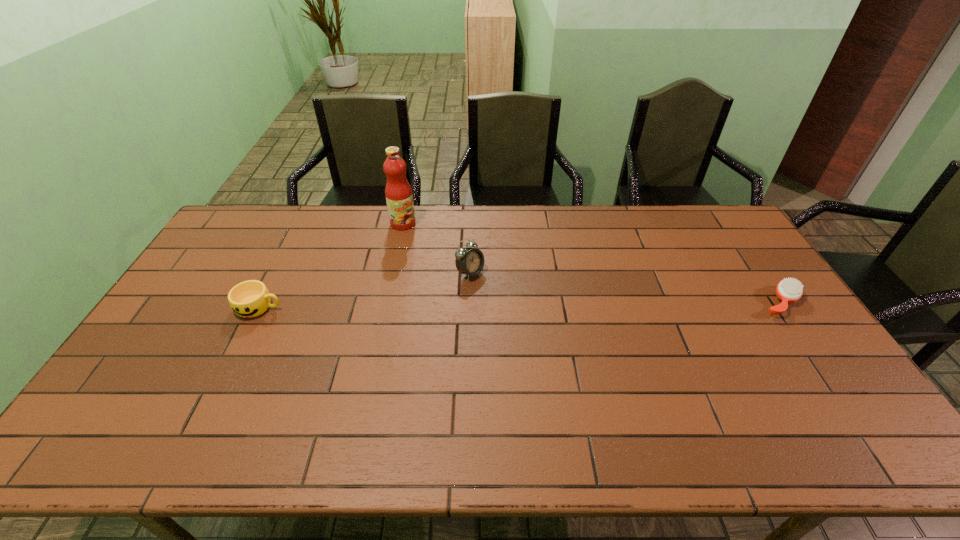
The image size is (960, 540). What are the coordinates of `free space at the right edge of the desktop` in the screenshot? It's located at (736, 261).

In the image, there is a desktop. In order to click on vacant space at the far left corner in this screenshot , I will do pyautogui.click(x=261, y=231).

What are the coordinates of `free space between the second object from right to left and the rightmost object` in the screenshot? It's located at (625, 287).

This screenshot has height=540, width=960. What are the coordinates of `vacant space that's between the fruit juice and the third nearest object` in the screenshot? It's located at (437, 248).

The image size is (960, 540). Identify the location of unoccupied area between the second tallest object and the cup. (365, 290).

The height and width of the screenshot is (540, 960). Find the location of `vacant point located between the second object from left to right and the second shortest object`. vacant point located between the second object from left to right and the second shortest object is located at coordinates (331, 265).

In order to click on vacant area between the second farthest object and the cup in this screenshot , I will do `click(365, 290)`.

You are a GUI agent. You are given a task and a screenshot of the screen. Output one action in this format:
    pyautogui.click(x=<x>, y=<y>)
    Task: Click on the free space that is in between the leftmost object and the farthest object
    The height and width of the screenshot is (540, 960).
    Given the screenshot: What is the action you would take?
    pyautogui.click(x=331, y=265)

At what (x,y) coordinates should I click in order to perform the action: click on free spot between the alarm clock and the cup. Please return your answer as a coordinate pair (x, y). This screenshot has width=960, height=540. Looking at the image, I should click on (365, 290).

Identify the location of vacant area between the shortest object and the third tallest object. (520, 305).